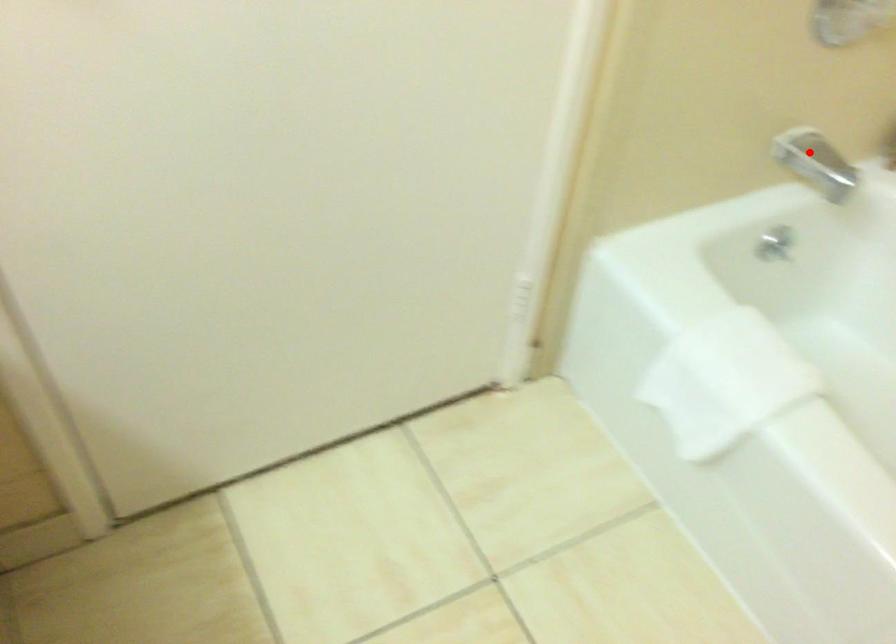
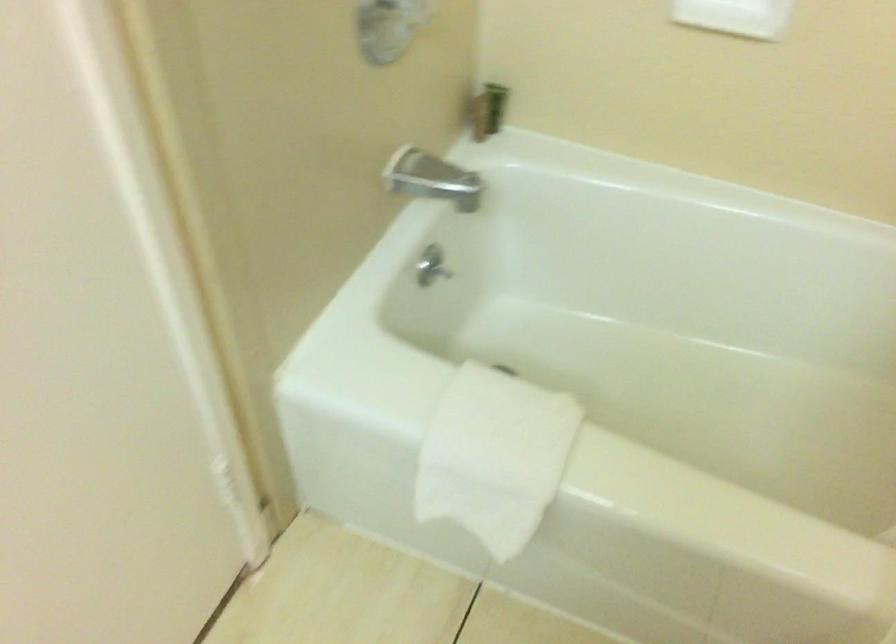
Where in the second image is the point corresponding to the highlighted location from the first image?

(424, 176)